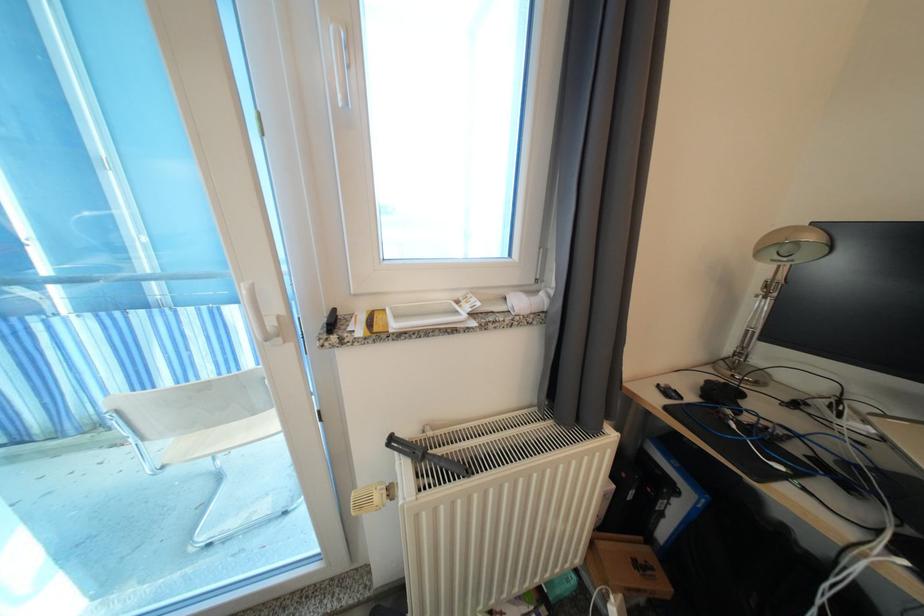
Where would you sit the chair sitting surface? Please return your answer as a coordinate pair (x, y).

(221, 438)